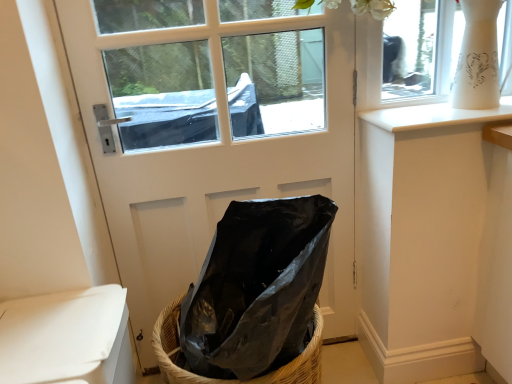
Question: Is woven straw basket at lower center not close to white matte toilet at lower left?

Choices:
 (A) yes
 (B) no

Answer: (B)

Question: Could white matte toilet at lower left be considered to be inside woven straw basket at lower center?

Choices:
 (A) yes
 (B) no

Answer: (B)

Question: Considering the relative sizes of woven straw basket at lower center and white matte toilet at lower left in the image provided, is woven straw basket at lower center smaller than white matte toilet at lower left?

Choices:
 (A) yes
 (B) no

Answer: (B)

Question: Can you confirm if woven straw basket at lower center is thinner than white matte toilet at lower left?

Choices:
 (A) no
 (B) yes

Answer: (A)

Question: From the image's perspective, is woven straw basket at lower center beneath white matte toilet at lower left?

Choices:
 (A) yes
 (B) no

Answer: (A)

Question: Is woven straw basket at lower center taller than white matte toilet at lower left?

Choices:
 (A) no
 (B) yes

Answer: (B)

Question: Is white matte toilet at lower left far from white matte door at center?

Choices:
 (A) yes
 (B) no

Answer: (B)

Question: Would you say white matte toilet at lower left is outside white matte door at center?

Choices:
 (A) no
 (B) yes

Answer: (B)

Question: Is white matte toilet at lower left oriented towards white matte door at center?

Choices:
 (A) yes
 (B) no

Answer: (B)

Question: From a real-world perspective, does white matte toilet at lower left sit lower than white matte door at center?

Choices:
 (A) yes
 (B) no

Answer: (A)

Question: Can you confirm if white matte toilet at lower left is taller than white matte door at center?

Choices:
 (A) no
 (B) yes

Answer: (A)

Question: Would you say white matte toilet at lower left contains white matte door at center?

Choices:
 (A) yes
 (B) no

Answer: (B)

Question: From a real-world perspective, is white glossy window sill at upper right physically above black plastic bag at center?

Choices:
 (A) yes
 (B) no

Answer: (A)